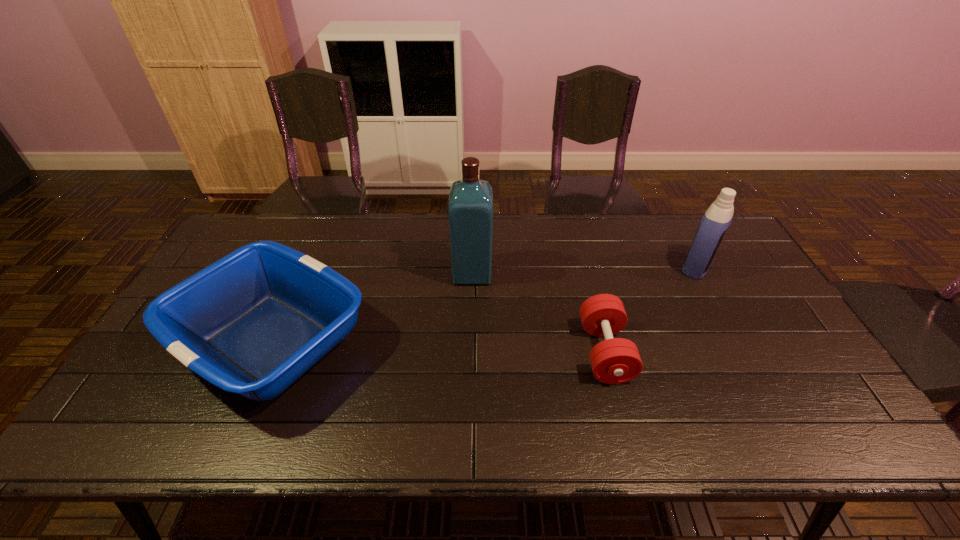
You are a GUI agent. You are given a task and a screenshot of the screen. Output one action in this format:
    pyautogui.click(x=<x>, y=<y>)
    Task: Click on the vacant area that lies between the second shortest object and the dumbbell
    Image resolution: width=960 pixels, height=540 pixels.
    Given the screenshot: What is the action you would take?
    pyautogui.click(x=439, y=347)

Identify which object is the nearest to the second object from right to left. Please provide its 2D coordinates. Your answer should be formatted as a tuple, i.e. [(x, y)], where the tuple contains the x and y coordinates of a point satisfying the conditions above.

[(470, 208)]

This screenshot has height=540, width=960. In order to click on object that can be found as the third closest to the rightmost object in this screenshot , I will do `click(253, 322)`.

In order to click on free space that satisfies the following two spatial constraints: 1. on the flat label side of the tallest object; 2. on the front side of the second shortest object in this screenshot , I will do `click(470, 342)`.

Identify the location of vacant region that satisfies the following two spatial constraints: 1. on the flat label side of the tallest object; 2. on the back side of the shortest object. The width and height of the screenshot is (960, 540). [x=470, y=352].

Locate an element on the screen. The image size is (960, 540). vacant space that satisfies the following two spatial constraints: 1. on the flat label side of the third object from right to left; 2. on the front side of the tray is located at coordinates click(x=470, y=342).

The image size is (960, 540). In order to click on free space that satisfies the following two spatial constraints: 1. on the back side of the rightmost object; 2. on the left side of the dumbbell in this screenshot , I will do `click(583, 267)`.

The height and width of the screenshot is (540, 960). I want to click on blank area in the image that satisfies the following two spatial constraints: 1. on the flat label side of the liquor; 2. on the left side of the shortest object, so (470, 352).